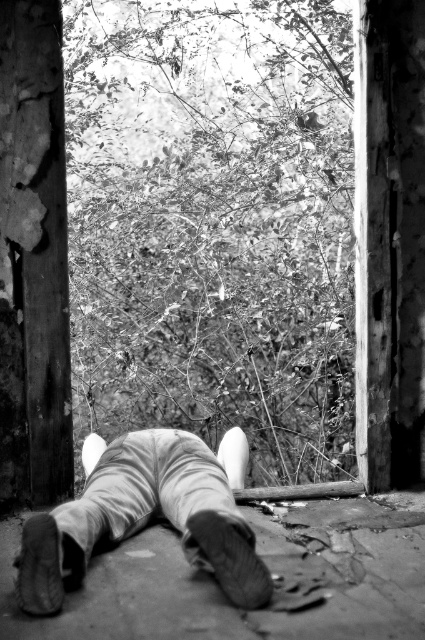
Question: Estimate the real-world distances between objects in this image. Which object is farther from the rusty metal pillar at left?

Choices:
 (A) smooth concrete pillar at right
 (B) leather shoes at lower center

Answer: (A)

Question: From the image, what is the correct spatial relationship of rusty metal pillar at left in relation to smooth concrete pillar at right?

Choices:
 (A) left
 (B) right

Answer: (A)

Question: Which of these objects is positioned closest to the rusty metal pillar at left?

Choices:
 (A) smooth concrete pillar at right
 (B) leather shoes at lower center

Answer: (B)

Question: Among these points, which one is nearest to the camera?

Choices:
 (A) (115, 531)
 (B) (11, 83)
 (C) (413, 60)

Answer: (A)

Question: Can you confirm if rusty metal pillar at left is thinner than leather shoes at lower center?

Choices:
 (A) yes
 (B) no

Answer: (A)

Question: Is the position of smooth concrete pillar at right less distant than that of leather shoes at lower center?

Choices:
 (A) yes
 (B) no

Answer: (B)